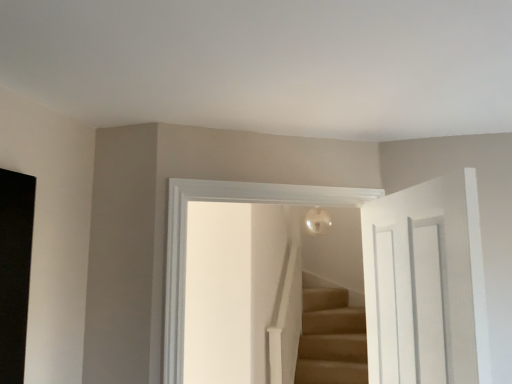
At what (x,y) coordinates should I click in order to perform the action: click on white matte door at right. Please return your answer as a coordinate pair (x, y). Looking at the image, I should click on (441, 272).

What do you see at coordinates (441, 272) in the screenshot?
I see `white matte door at right` at bounding box center [441, 272].

Locate an element on the screen. The image size is (512, 384). white matte door at right is located at coordinates [x=441, y=272].